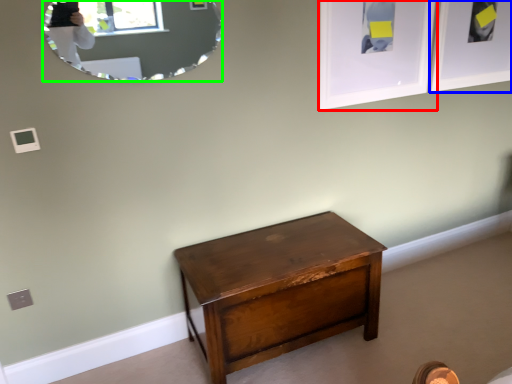
Question: Based on their relative distances, which object is nearer to picture frame (highlighted by a red box)? Choose from picture frame (highlighted by a blue box) and mirror (highlighted by a green box).

Choices:
 (A) picture frame
 (B) mirror

Answer: (A)